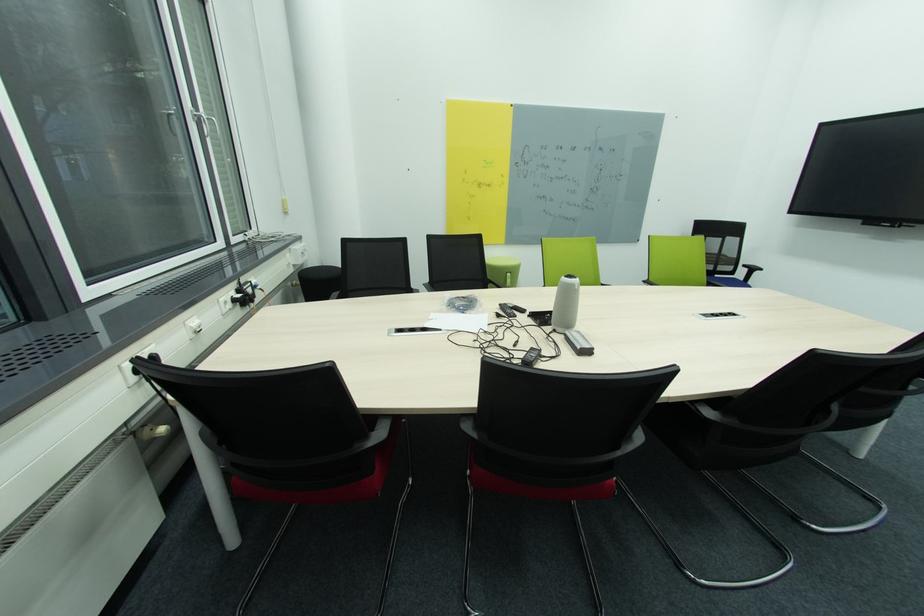
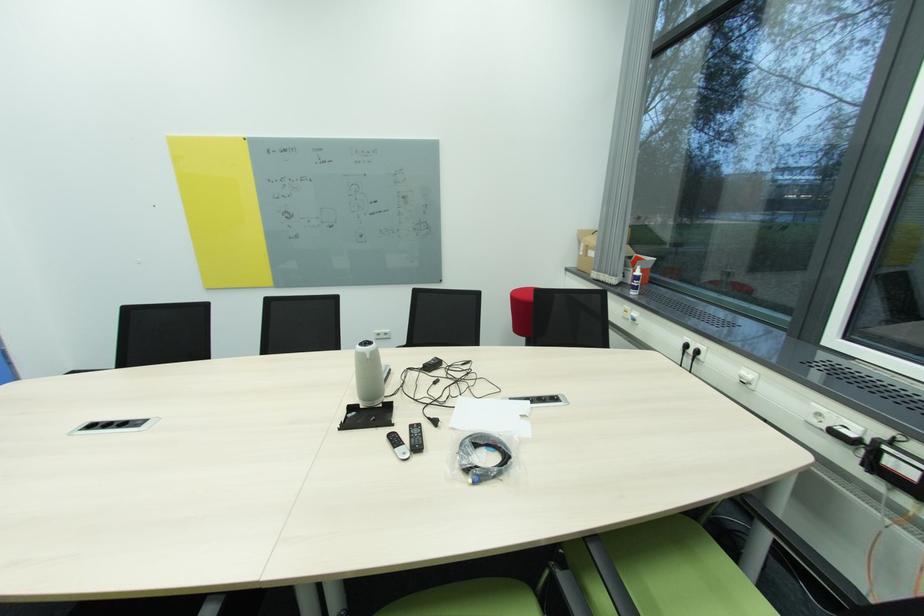
In the second image, find the point that corresponds to [519,317] in the first image.

(416, 427)